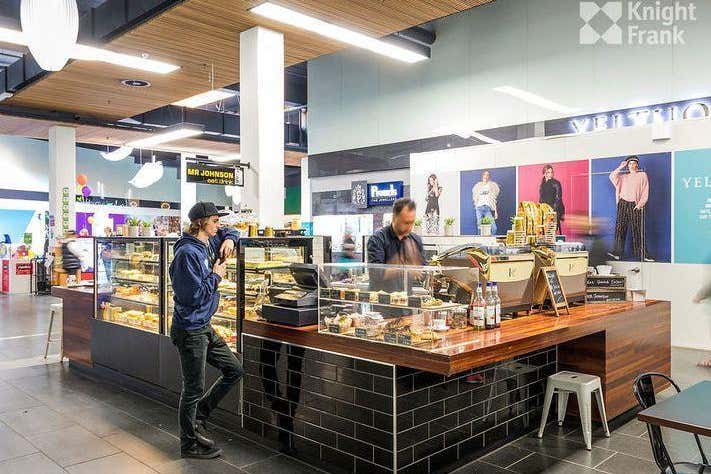
The image size is (711, 474). What are the coordinates of `chair` in the screenshot? It's located at (641, 395).